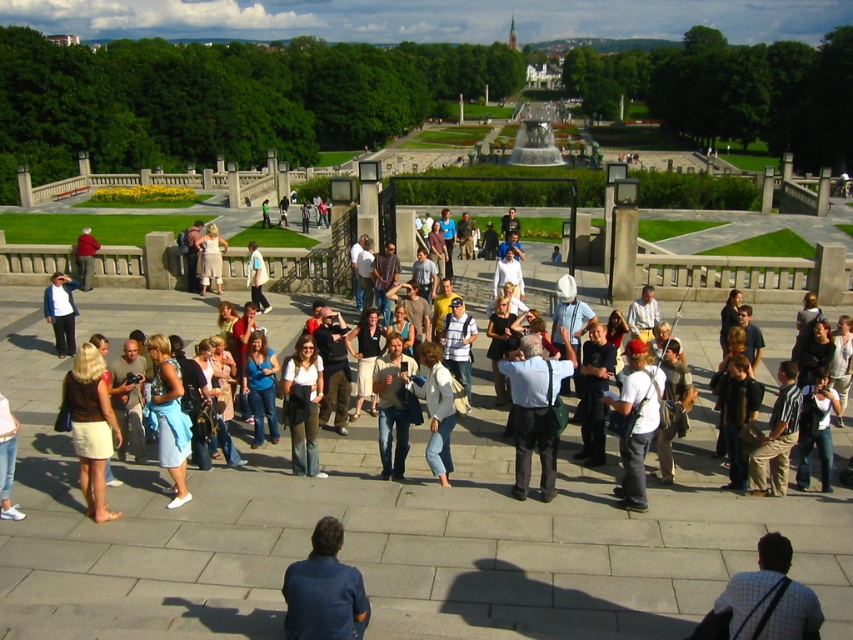
Is point (73, 420) positioned behind point (157, 410)?

No, it is in front of (157, 410).

At what (x,y) coordinates should I click in order to perform the action: click on brown leather skirt at center. Please return your answer as a coordinate pair (x, y). Looking at the image, I should click on (91, 426).

Who is taller, light blue shirt at center or white cotton shirt at center?

light blue shirt at center

Based on the photo, can you confirm if light blue shirt at center is positioned above white cotton shirt at center?

No, light blue shirt at center is not above white cotton shirt at center.

Between point (541, 481) and point (457, 378), which one is positioned behind?

Point (457, 378)

Find the location of `light blue shirt at center`. light blue shirt at center is located at coordinates (534, 410).

Is white cotton shirt at center positioned at the back of light beige dress at center?

No, white cotton shirt at center is closer to the viewer.

Image resolution: width=853 pixels, height=640 pixels. What do you see at coordinates (457, 342) in the screenshot?
I see `white cotton shirt at center` at bounding box center [457, 342].

Between point (456, 365) and point (202, 262), which one is positioned behind?

Positioned behind is point (202, 262).

Locate an element on the screen. Image resolution: width=853 pixels, height=640 pixels. white cotton shirt at center is located at coordinates (457, 342).